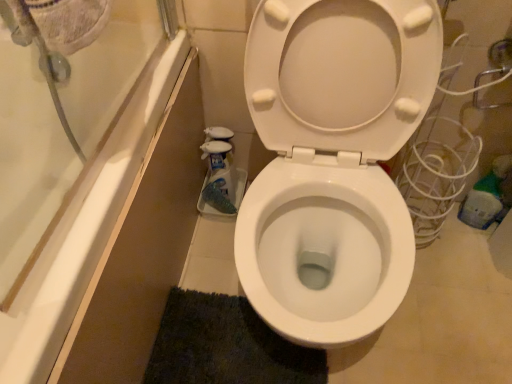
The width and height of the screenshot is (512, 384). Describe the element at coordinates (333, 159) in the screenshot. I see `white glossy toilet at center` at that location.

Locate an element on the screen. white glossy toilet at center is located at coordinates (333, 159).

Describe the element at coordinates (225, 345) in the screenshot. The width and height of the screenshot is (512, 384). I see `dark blue textured bath mat at lower center` at that location.

Locate an element on the screen. The height and width of the screenshot is (384, 512). dark blue textured bath mat at lower center is located at coordinates (225, 345).

Where is `white glossy toilet at center`? white glossy toilet at center is located at coordinates (333, 159).

Between dark blue textured bath mat at lower center and white glossy toilet at center, which one appears on the right side from the viewer's perspective?

white glossy toilet at center is more to the right.

In the image, is dark blue textured bath mat at lower center positioned in front of or behind white glossy toilet at center?

dark blue textured bath mat at lower center is behind white glossy toilet at center.

Between point (236, 367) and point (395, 247), which one is positioned behind?

Positioned behind is point (236, 367).

From the image's perspective, which object appears higher, dark blue textured bath mat at lower center or white glossy toilet at center?

From the image's view, white glossy toilet at center is above.

From a real-world perspective, does dark blue textured bath mat at lower center stand above white glossy toilet at center?

No, from a real-world perspective, dark blue textured bath mat at lower center is not on top of white glossy toilet at center.

In terms of width, does dark blue textured bath mat at lower center look wider or thinner when compared to white glossy toilet at center?

Clearly, dark blue textured bath mat at lower center has less width compared to white glossy toilet at center.

Considering the relative sizes of dark blue textured bath mat at lower center and white glossy toilet at center in the image provided, is dark blue textured bath mat at lower center shorter than white glossy toilet at center?

Yes, dark blue textured bath mat at lower center is shorter than white glossy toilet at center.

Is dark blue textured bath mat at lower center smaller than white glossy toilet at center?

Correct, dark blue textured bath mat at lower center occupies less space than white glossy toilet at center.

Is white glossy toilet at center completely or partially inside dark blue textured bath mat at lower center?

Actually, white glossy toilet at center is outside dark blue textured bath mat at lower center.

Are dark blue textured bath mat at lower center and white glossy toilet at center making contact?

No, dark blue textured bath mat at lower center is not touching white glossy toilet at center.

Is dark blue textured bath mat at lower center aimed at white glossy toilet at center?

Yes, dark blue textured bath mat at lower center is oriented towards white glossy toilet at center.

How many degrees apart are the facing directions of dark blue textured bath mat at lower center and white glossy toilet at center?

The facing directions of dark blue textured bath mat at lower center and white glossy toilet at center are 91.1 degrees apart.

The height and width of the screenshot is (384, 512). In the image, there is a dark blue textured bath mat at lower center. In order to click on toilet above it (from the image's perspective) in this screenshot , I will do `click(333, 159)`.

Is white glossy toilet at center at the right side of dark blue textured bath mat at lower center?

Correct, you'll find white glossy toilet at center to the right of dark blue textured bath mat at lower center.

From the picture: Is the depth of white glossy toilet at center less than that of dark blue textured bath mat at lower center?

Yes, it is in front of dark blue textured bath mat at lower center.

Does point (379, 231) lie behind point (189, 311)?

That is False.

From the image's perspective, is white glossy toilet at center on top of dark blue textured bath mat at lower center?

Yes, from the image's perspective, white glossy toilet at center is over dark blue textured bath mat at lower center.

From a real-world perspective, who is located lower, white glossy toilet at center or dark blue textured bath mat at lower center?

dark blue textured bath mat at lower center, from a real-world perspective.

Does white glossy toilet at center have a greater width compared to dark blue textured bath mat at lower center?

Indeed, white glossy toilet at center has a greater width compared to dark blue textured bath mat at lower center.

Who is shorter, white glossy toilet at center or dark blue textured bath mat at lower center?

dark blue textured bath mat at lower center.

Between white glossy toilet at center and dark blue textured bath mat at lower center, which one has larger size?

Bigger between the two is white glossy toilet at center.

Is white glossy toilet at center inside the boundaries of dark blue textured bath mat at lower center, or outside?

white glossy toilet at center is spatially situated outside dark blue textured bath mat at lower center.

Is white glossy toilet at center directly adjacent to dark blue textured bath mat at lower center?

They are not placed beside each other.

Could you tell me if white glossy toilet at center is facing dark blue textured bath mat at lower center?

No, white glossy toilet at center is not aimed at dark blue textured bath mat at lower center.

There is a dark blue textured bath mat at lower center. Where is `toilet above it (from a real-world perspective)`? The image size is (512, 384). toilet above it (from a real-world perspective) is located at coordinates (333, 159).

Where is `toilet in front of the dark blue textured bath mat at lower center`? The width and height of the screenshot is (512, 384). toilet in front of the dark blue textured bath mat at lower center is located at coordinates (333, 159).

Where is `bath mat that appears below the white glossy toilet at center (from the image's perspective)`? The image size is (512, 384). bath mat that appears below the white glossy toilet at center (from the image's perspective) is located at coordinates (225, 345).